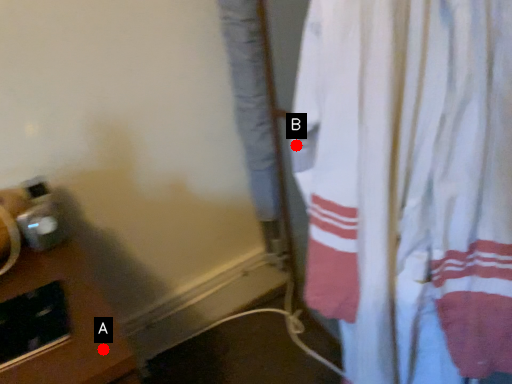
Question: Two points are circled on the image, labeled by A and B beside each circle. Which point is closer to the camera?

Choices:
 (A) A is closer
 (B) B is closer

Answer: (A)